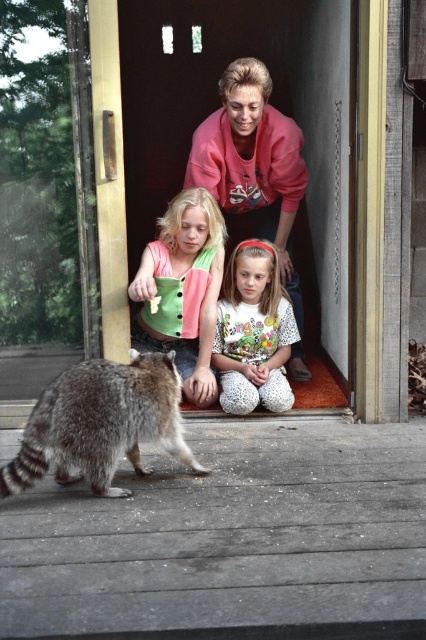
Question: Which object is farther from the camera taking this photo?

Choices:
 (A) pink fleece at center
 (B) green fabric shirt at center
 (C) white dotted pants at lower center

Answer: (A)

Question: Can you confirm if green fabric shirt at center is positioned to the left of white dotted pants at lower center?

Choices:
 (A) no
 (B) yes

Answer: (B)

Question: Among these objects, which one is nearest to the camera?

Choices:
 (A) white dotted pants at lower center
 (B) fuzzy gray raccoon at lower left
 (C) pink fleece at center

Answer: (B)

Question: Can you confirm if green fabric shirt at center is positioned to the right of white dotted pants at lower center?

Choices:
 (A) no
 (B) yes

Answer: (A)

Question: Which point is farther from the camera taking this photo?

Choices:
 (A) (89, 468)
 (B) (169, 276)
 (C) (262, 204)

Answer: (C)

Question: Considering the relative positions of pink fleece at center and green fabric shirt at center in the image provided, where is pink fleece at center located with respect to green fabric shirt at center?

Choices:
 (A) below
 (B) above

Answer: (B)